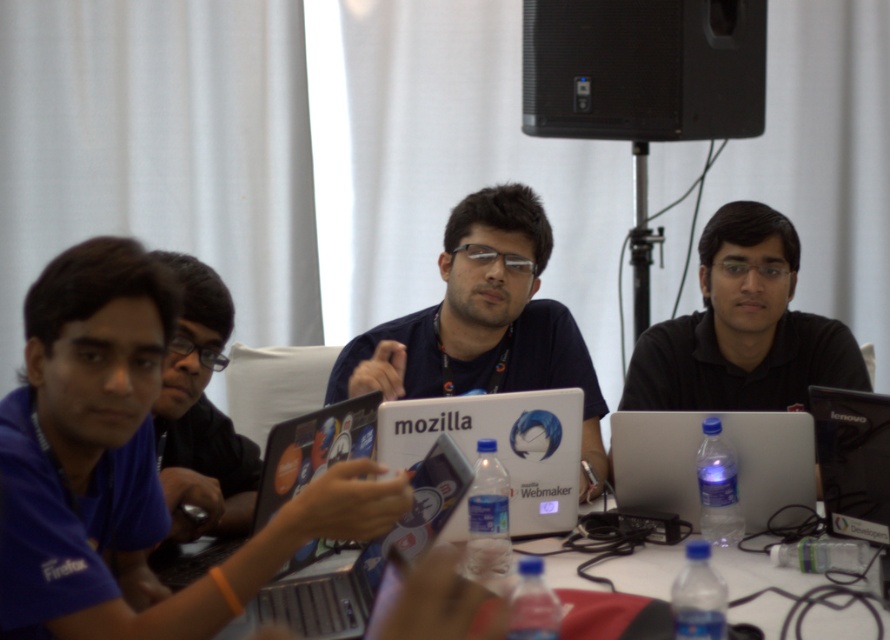
Question: Can you confirm if metallic silver laptop at center is thinner than shiny black laptop at center?

Choices:
 (A) yes
 (B) no

Answer: (A)

Question: Can you confirm if shiny black laptop at center is bigger than black plastic laptop at lower right?

Choices:
 (A) no
 (B) yes

Answer: (B)

Question: Does black matte speaker at upper center have a lesser width compared to sleek silver laptop at center?

Choices:
 (A) no
 (B) yes

Answer: (A)

Question: Among these points, which one is nearest to the camera?

Choices:
 (A) (657, 417)
 (B) (633, 140)

Answer: (A)

Question: Among these points, which one is nearest to the camera?

Choices:
 (A) (708, 308)
 (B) (452, 272)
 (C) (563, 124)
 (D) (595, 634)

Answer: (D)

Question: Estimate the real-world distances between objects in this image. Which object is farther from the black plastic laptop at lower right?

Choices:
 (A) white plastic table at center
 (B) matte black laptop at center
 (C) blue fabric shirt at left

Answer: (C)